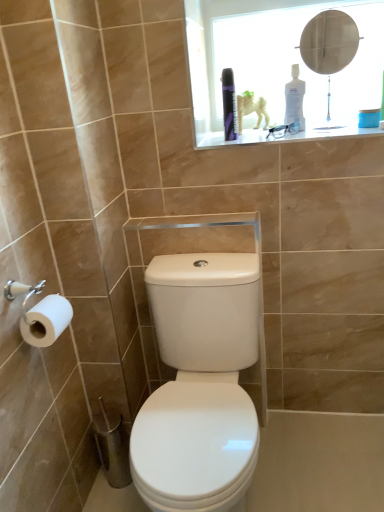
Question: Is metallic round mirror at upper center situated inside white plastic bottle at upper center, the second toiletry when ordered from left to right, or outside?

Choices:
 (A) inside
 (B) outside

Answer: (B)

Question: From a real-world perspective, is metallic round mirror at upper center above or below white plastic bottle at upper center, positioned as the first toiletry in right-to-left order?

Choices:
 (A) below
 (B) above

Answer: (B)

Question: Estimate the real-world distances between objects in this image. Which object is farther from the white matte toilet paper at left?

Choices:
 (A) transparent plastic medicine cabinet at upper center
 (B) purple glossy can at upper center, which is the first toiletry from left to right
 (C) metallic round mirror at upper center
 (D) white plastic bottle at upper center, positioned as the first toiletry in right-to-left order

Answer: (C)

Question: Which is nearer to the white plastic bottle at upper center, the second toiletry when ordered from left to right?

Choices:
 (A) metallic round mirror at upper center
 (B) purple glossy can at upper center, which appears as the 2th toiletry when viewed from the right
 (C) white matte toilet paper at left
 (D) transparent plastic medicine cabinet at upper center

Answer: (D)